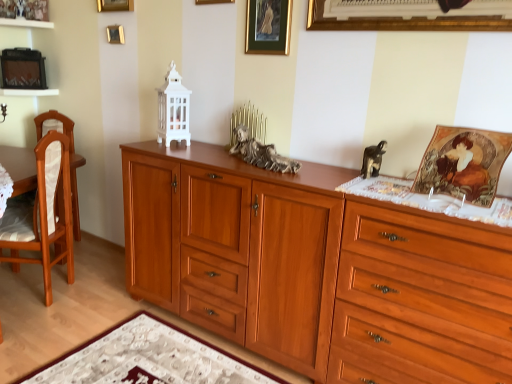
This screenshot has height=384, width=512. What are the coordinates of `vacant region in front of light brown wood chair at left` in the screenshot? It's located at (28, 329).